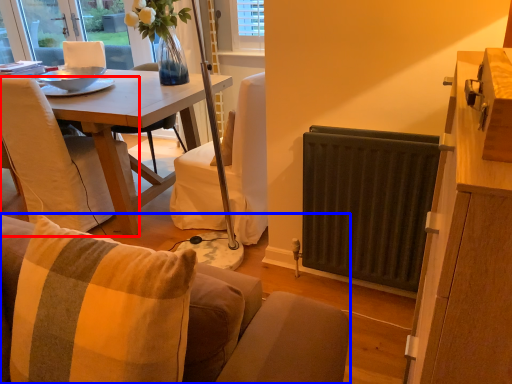
Question: Which object appears farthest to the camera in this image, chair (highlighted by a red box) or studio couch (highlighted by a blue box)?

Choices:
 (A) chair
 (B) studio couch

Answer: (A)